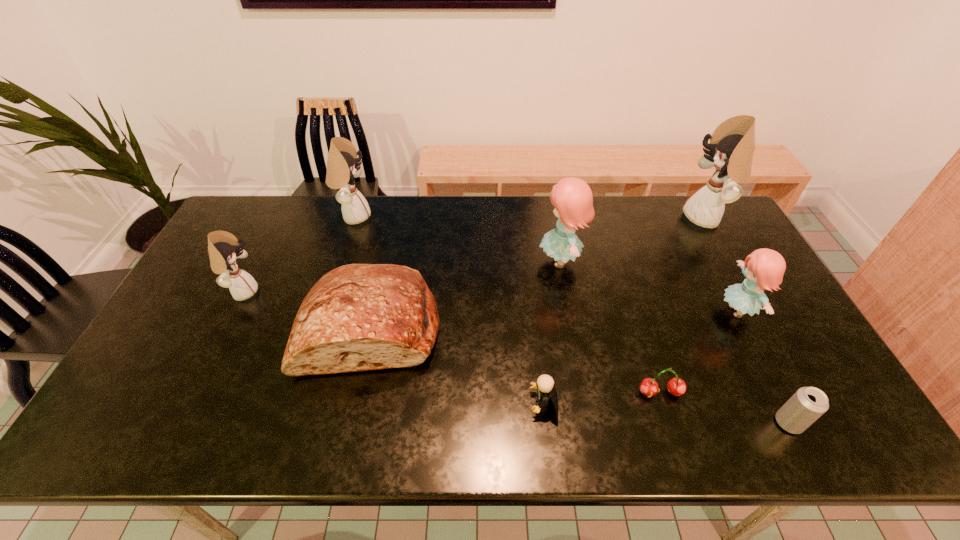
At what (x,y) coordinates should I click in order to perform the action: click on the biggest black doll. Please return your answer as a coordinate pair (x, y). Image resolution: width=960 pixels, height=540 pixels. Looking at the image, I should click on (732, 144).

Identify the location of the tallest doll. (732, 144).

The image size is (960, 540). I want to click on the second black doll from left to right, so click(343, 166).

This screenshot has width=960, height=540. Find the location of `the second doll from left to right`. the second doll from left to right is located at coordinates (343, 166).

Locate an element on the screen. Image resolution: width=960 pixels, height=540 pixels. the third doll from right to left is located at coordinates (572, 198).

Where is `the left blue doll`? This screenshot has height=540, width=960. the left blue doll is located at coordinates (572, 198).

Locate an element on the screen. The image size is (960, 540). the leftmost black doll is located at coordinates (223, 247).

Locate an element on the screen. The width and height of the screenshot is (960, 540). the smallest black doll is located at coordinates (223, 247).

Find the location of a particular element. the right blue doll is located at coordinates (764, 268).

Find the location of a particular element. the fourth shortest object is located at coordinates (358, 317).